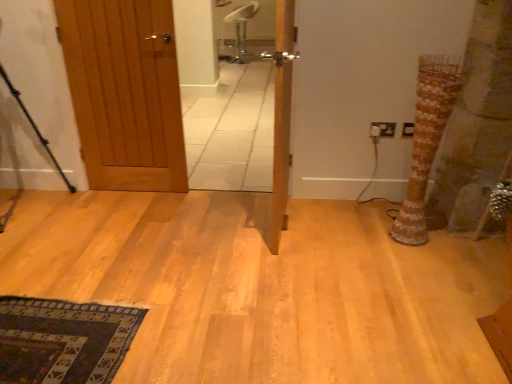
Question: Is wooden door at left, marked as the second door in a right-to-left arrangement, thinner than wooden door at center, which is counted as the second door, starting from the left?

Choices:
 (A) no
 (B) yes

Answer: (B)

Question: Considering the relative sizes of wooden door at left, the 1th door viewed from the left, and wooden door at center, which is counted as the second door, starting from the left, in the image provided, is wooden door at left, the 1th door viewed from the left, bigger than wooden door at center, which is counted as the second door, starting from the left,?

Choices:
 (A) no
 (B) yes

Answer: (A)

Question: Does wooden door at left, the 1th door viewed from the left, have a smaller size compared to wooden door at center, which is counted as the second door, starting from the left?

Choices:
 (A) yes
 (B) no

Answer: (A)

Question: Is wooden door at left, the 1th door viewed from the left, positioned in front of wooden door at center, which is counted as the second door, starting from the left?

Choices:
 (A) no
 (B) yes

Answer: (A)

Question: Is wooden door at left, the 1th door viewed from the left, far from wooden door at center, which is counted as the 1th door, starting from the right?

Choices:
 (A) no
 (B) yes

Answer: (A)

Question: Considering the positions of white plastic electric outlet at right, the first electric outlet viewed from the left, and wooden door at left, the 1th door viewed from the left, in the image, is white plastic electric outlet at right, the first electric outlet viewed from the left, taller or shorter than wooden door at left, the 1th door viewed from the left,?

Choices:
 (A) short
 (B) tall

Answer: (A)

Question: From the image's perspective, relative to wooden door at left, the 1th door viewed from the left, is white plastic electric outlet at right, the second electric outlet viewed from the right, above or below?

Choices:
 (A) above
 (B) below

Answer: (B)

Question: Do you think white plastic electric outlet at right, the first electric outlet viewed from the left, is within wooden door at left, the 1th door viewed from the left, or outside of it?

Choices:
 (A) outside
 (B) inside

Answer: (A)

Question: Looking at the image, does white plastic electric outlet at right, the second electric outlet viewed from the right, seem bigger or smaller compared to wooden door at left, marked as the second door in a right-to-left arrangement?

Choices:
 (A) small
 (B) big

Answer: (A)

Question: Looking at the image, does wooden door at center, which is counted as the 1th door, starting from the right, seem bigger or smaller compared to white plastic chair at upper center?

Choices:
 (A) big
 (B) small

Answer: (B)

Question: Is wooden door at center, which is counted as the 1th door, starting from the right, in front of or behind white plastic chair at upper center in the image?

Choices:
 (A) behind
 (B) front

Answer: (B)

Question: From the image's perspective, relative to white plastic chair at upper center, is wooden door at center, which is counted as the 1th door, starting from the right, above or below?

Choices:
 (A) above
 (B) below

Answer: (B)

Question: Based on their positions, is wooden door at center, which is counted as the second door, starting from the left, located to the left or right of white plastic chair at upper center?

Choices:
 (A) left
 (B) right

Answer: (B)

Question: Is white plastic chair at upper center wider or thinner than black metal tripod at left?

Choices:
 (A) thin
 (B) wide

Answer: (B)

Question: In terms of height, does white plastic chair at upper center look taller or shorter compared to black metal tripod at left?

Choices:
 (A) short
 (B) tall

Answer: (A)